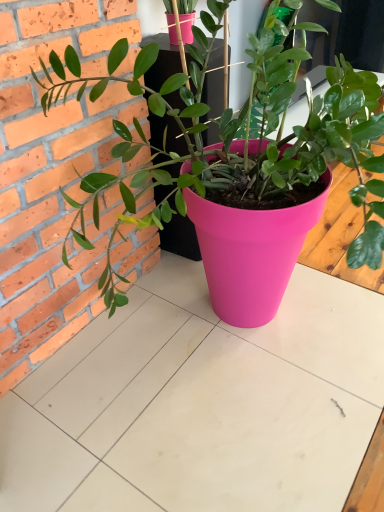
Describe the element at coordinates (243, 159) in the screenshot. This screenshot has width=384, height=512. I see `matte pink pot at center` at that location.

The height and width of the screenshot is (512, 384). I want to click on matte pink pot at center, so click(243, 159).

Image resolution: width=384 pixels, height=512 pixels. Describe the element at coordinates (200, 403) in the screenshot. I see `matte pink pot at center` at that location.

At what (x,y) coordinates should I click in order to perform the action: click on matte pink pot at center. Please return your answer as a coordinate pair (x, y). This screenshot has width=384, height=512. Looking at the image, I should click on (200, 403).

Measure the distance between matte pink pot at center and camera.

The distance of matte pink pot at center from camera is 1.09 meters.

Identify the location of matte pink pot at center. The height and width of the screenshot is (512, 384). (243, 159).

Based on the photo, considering the positions of objects matte pink pot at center and matte pink pot at center in the image provided, who is more to the right, matte pink pot at center or matte pink pot at center?

matte pink pot at center.

Relative to matte pink pot at center, is matte pink pot at center in front or behind?

Visually, matte pink pot at center is located behind matte pink pot at center.

Considering the positions of point (315, 362) and point (81, 182), is point (315, 362) closer or farther from the camera than point (81, 182)?

Point (315, 362).

From the image's perspective, who appears lower, matte pink pot at center or matte pink pot at center?

matte pink pot at center, from the image's perspective.

Consider the image. From a real-world perspective, relative to matte pink pot at center, is matte pink pot at center vertically above or below?

From a real-world perspective, matte pink pot at center is physically below matte pink pot at center.

Which object is wider, matte pink pot at center or matte pink pot at center?

matte pink pot at center.

Between matte pink pot at center and matte pink pot at center, which one has more height?

With more height is matte pink pot at center.

Who is bigger, matte pink pot at center or matte pink pot at center?

matte pink pot at center.

Can we say matte pink pot at center lies outside matte pink pot at center?

That's correct, matte pink pot at center is outside of matte pink pot at center.

Is matte pink pot at center with matte pink pot at center?

No, matte pink pot at center is not with matte pink pot at center.

Based on the photo, is matte pink pot at center looking in the opposite direction of matte pink pot at center?

No, matte pink pot at center is not at the back of matte pink pot at center.

How many degrees apart are the facing directions of matte pink pot at center and matte pink pot at center?

matte pink pot at center and matte pink pot at center are facing 180 degrees away from each other.

Locate an element on the screen. The height and width of the screenshot is (512, 384). table that is below the matte pink pot at center (from the image's perspective) is located at coordinates (200, 403).

Which object is positioned more to the left, matte pink pot at center or matte pink pot at center?

matte pink pot at center.

Considering the positions of objects matte pink pot at center and matte pink pot at center in the image provided, who is in front, matte pink pot at center or matte pink pot at center?

matte pink pot at center is in front.

Which is behind, point (265, 257) or point (326, 295)?

The point (326, 295) is behind.

In the scene shown: From the image's perspective, does matte pink pot at center appear lower than matte pink pot at center?

No, from the image's perspective, matte pink pot at center is not beneath matte pink pot at center.

From a real-world perspective, between matte pink pot at center and matte pink pot at center, who is vertically higher?

In real-world perspective, matte pink pot at center is above.

In the scene shown: Considering the relative sizes of matte pink pot at center and matte pink pot at center in the image provided, is matte pink pot at center thinner than matte pink pot at center?

Indeed, matte pink pot at center has a lesser width compared to matte pink pot at center.

Considering the sizes of objects matte pink pot at center and matte pink pot at center in the image provided, who is shorter, matte pink pot at center or matte pink pot at center?

Standing shorter between the two is matte pink pot at center.

Is matte pink pot at center bigger than matte pink pot at center?

Indeed, matte pink pot at center has a larger size compared to matte pink pot at center.

Is matte pink pot at center situated inside matte pink pot at center or outside?

matte pink pot at center is not inside matte pink pot at center, it's outside.

Is matte pink pot at center far from matte pink pot at center?

matte pink pot at center is actually quite close to matte pink pot at center.

In the scene shown: Is matte pink pot at center oriented away from matte pink pot at center?

That's not correct — matte pink pot at center is not looking away from matte pink pot at center.

How many degrees apart are the facing directions of matte pink pot at center and matte pink pot at center?

The angular difference between matte pink pot at center and matte pink pot at center is 180 degrees.

You are a GUI agent. You are given a task and a screenshot of the screen. Output one action in this format:
    pyautogui.click(x=<x>, y=<y>)
    Task: Click on the houseplant in front of the matte pink pot at center
    The height and width of the screenshot is (512, 384).
    Given the screenshot: What is the action you would take?
    pyautogui.click(x=243, y=159)

This screenshot has height=512, width=384. Find the location of `houseplant in front of the matte pink pot at center`. houseplant in front of the matte pink pot at center is located at coordinates [243, 159].

Where is `table lying on the right of matte pink pot at center`? table lying on the right of matte pink pot at center is located at coordinates (200, 403).